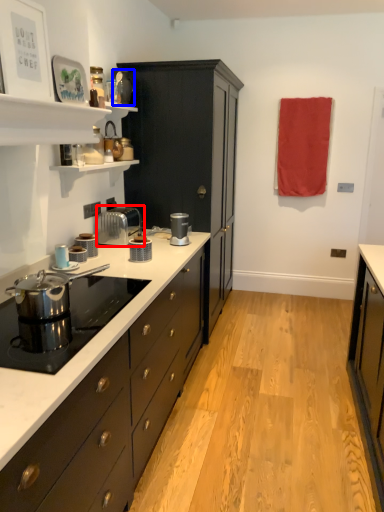
Question: Which of the following is the closest to the observer, toaster (highlighted by a red box) or appliance (highlighted by a blue box)?

Choices:
 (A) toaster
 (B) appliance

Answer: (A)